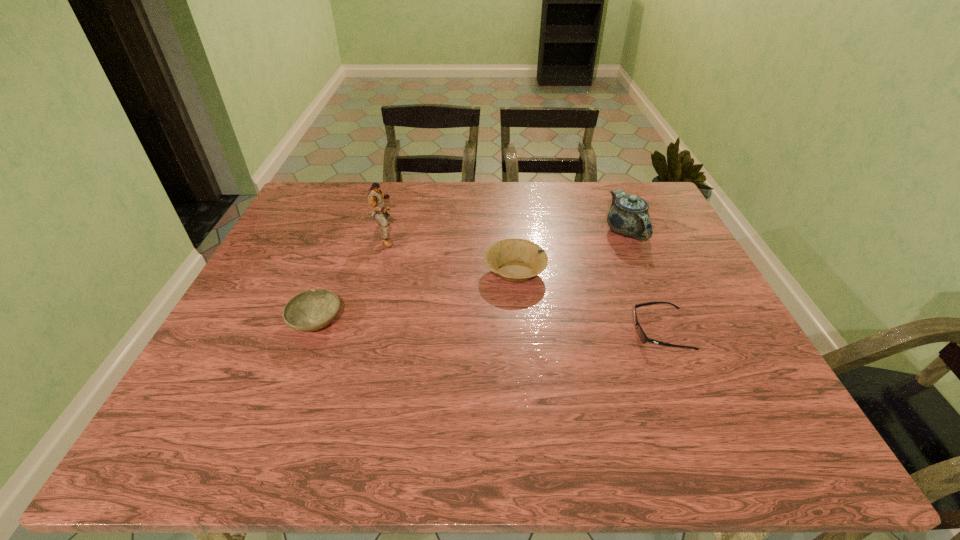
Locate an element on the screen. puncher is located at coordinates (375, 196).

The height and width of the screenshot is (540, 960). I want to click on the tallest object, so click(x=375, y=196).

Where is `chinaware`? The height and width of the screenshot is (540, 960). chinaware is located at coordinates (628, 216).

Identify the location of the third farthest object. (516, 260).

Where is `the right bowl`? the right bowl is located at coordinates (516, 260).

Locate an element on the screen. Image resolution: width=960 pixels, height=540 pixels. the nearer bowl is located at coordinates (311, 310).

Find the location of `the leftmost object`. the leftmost object is located at coordinates (311, 310).

Where is `sunglasses`? This screenshot has width=960, height=540. sunglasses is located at coordinates (641, 333).

Locate an element on the screen. This screenshot has height=540, width=960. vacant region located 0.110m on the front-facing side of the puncher is located at coordinates (435, 234).

Image resolution: width=960 pixels, height=540 pixels. Find the location of `free spot located from the spout of the second tallest object`. free spot located from the spout of the second tallest object is located at coordinates (670, 335).